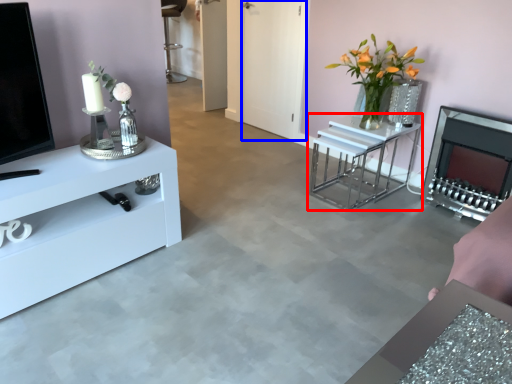
Question: Which point is further to the camera, table (highlighted by a red box) or glass door (highlighted by a blue box)?

Choices:
 (A) table
 (B) glass door

Answer: (B)